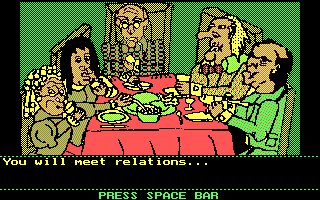
At what (x,y) coordinates should I click in order to perform the action: click on wine glass. Please return your answer as a coordinate pair (x, y). Looking at the image, I should click on (188, 101), (181, 79), (130, 59), (93, 85), (70, 108).